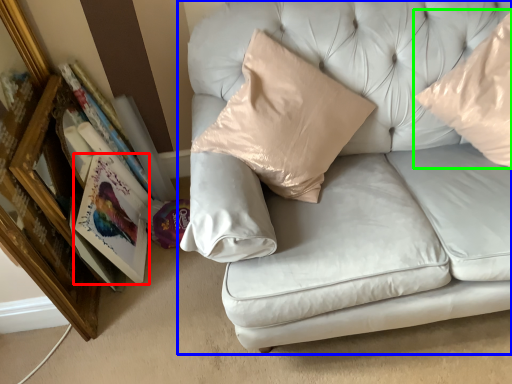
Question: Estimate the real-world distances between objects in this image. Which object is farther from paperback book (highlighted by a red box), studio couch (highlighted by a blue box) or pillow (highlighted by a green box)?

Choices:
 (A) studio couch
 (B) pillow

Answer: (B)